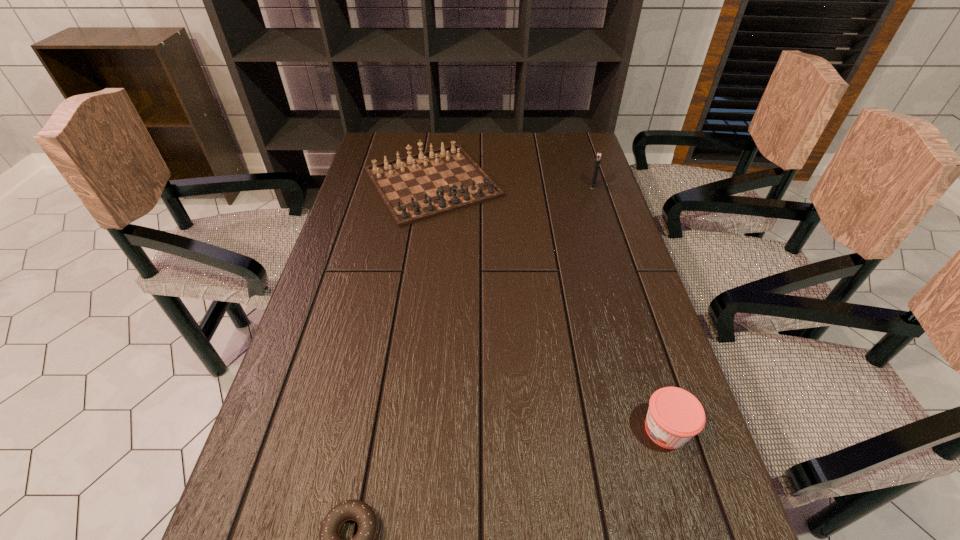
You are a GUI agent. You are given a task and a screenshot of the screen. Output one action in this format:
    pyautogui.click(x=<x>, y=<y>)
    Task: Click on the tallest object
    The width and height of the screenshot is (960, 540).
    Given the screenshot: What is the action you would take?
    pyautogui.click(x=598, y=157)

Locate an element on the screen. The height and width of the screenshot is (540, 960). chessboard is located at coordinates (414, 188).

Identify the location of the third farthest object. (674, 416).

Locate an element on the screen. The image size is (960, 540). vacant area situated 0.180m on the front of the tallest object is located at coordinates (605, 224).

Find the location of a particular element. The height and width of the screenshot is (540, 960). free space located 0.220m on the right of the chessboard is located at coordinates (570, 183).

You are a GUI agent. You are given a task and a screenshot of the screen. Output one action in this format:
    pyautogui.click(x=<x>, y=<y>)
    Task: Click on the free space located 0.150m on the front label of the jam
    
    Given the screenshot: What is the action you would take?
    pyautogui.click(x=563, y=429)

The image size is (960, 540). I want to click on free space located 0.100m on the front label of the jam, so click(x=588, y=429).

Find the location of a particular element. The height and width of the screenshot is (540, 960). vacant area situated on the front label of the jam is located at coordinates (541, 429).

This screenshot has height=540, width=960. I want to click on object situated at the far edge, so click(x=414, y=188).

You are a GUI agent. You are given a task and a screenshot of the screen. Output one action in this format:
    pyautogui.click(x=<x>, y=<y>)
    Task: Click on the object present at the left edge
    Image resolution: width=960 pixels, height=540 pixels.
    Given the screenshot: What is the action you would take?
    pyautogui.click(x=414, y=188)